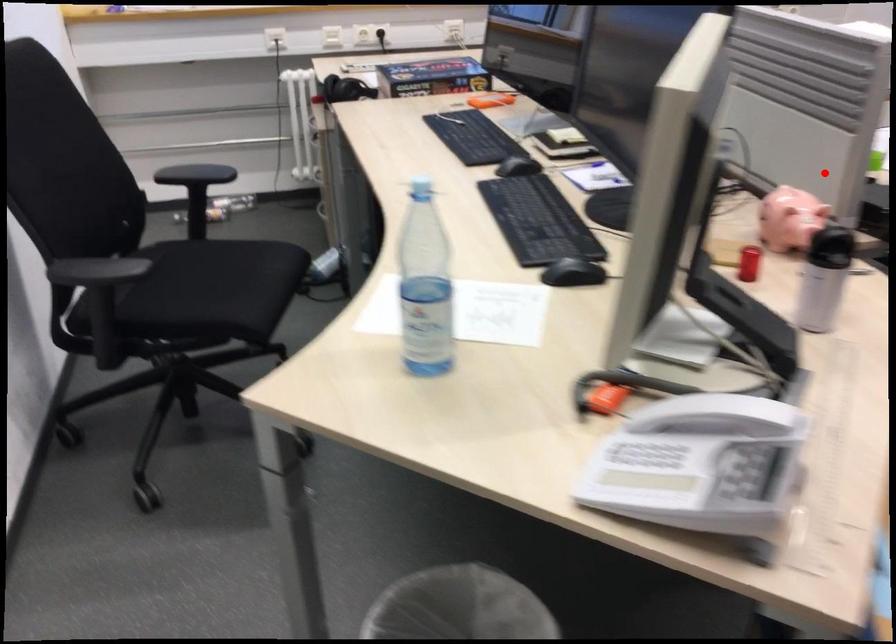
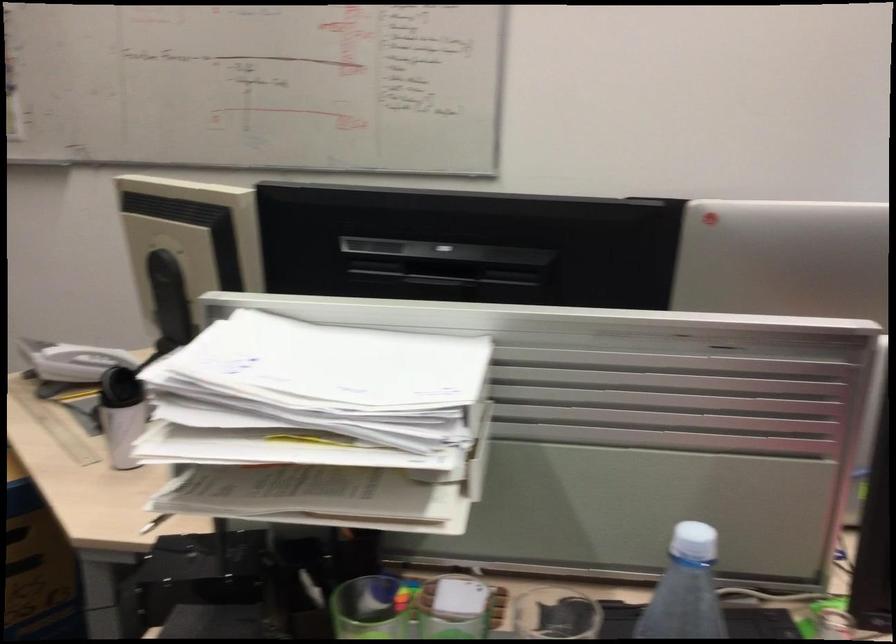
Question: I am providing you with two images of the same scene from different viewpoints. In image1, a red point is highlighted. Considering the same 3D point in image2, which of the following is correct?

Choices:
 (A) It is closer
 (B) It is farther

Answer: (A)